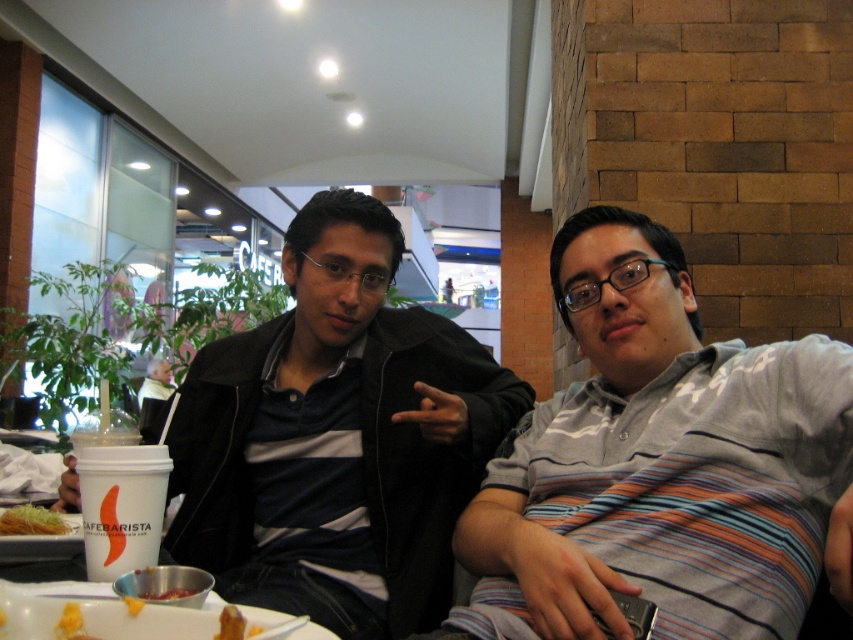
You are a GUI agent. You are given a task and a screenshot of the screen. Output one action in this format:
    pyautogui.click(x=<x>, y=<y>)
    Task: Click on the gray striped shirt at center
    This screenshot has height=640, width=853.
    Given the screenshot: What is the action you would take?
    pyautogui.click(x=660, y=465)

Can you confirm if gray striped shirt at center is shorter than matte black jacket at center?

Correct, gray striped shirt at center is not as tall as matte black jacket at center.

Between point (793, 348) and point (242, 392), which one is positioned in front?

Point (793, 348) is in front.

Where is `gray striped shirt at center`? The image size is (853, 640). gray striped shirt at center is located at coordinates (660, 465).

Measure the distance between point [254,408] and camera.

4.73 feet

Is point (314, 376) closer to viewer compared to point (28, 524)?

No.

Find the location of a particular element. This screenshot has width=853, height=640. matte black jacket at center is located at coordinates (337, 436).

Is point (15, 506) less distant than point (227, 614)?

No.

Who is more distant from viewer, (x=61, y=520) or (x=228, y=616)?

The point (x=61, y=520) is behind.

Identify the location of golden crispy noodles at lower left. (32, 520).